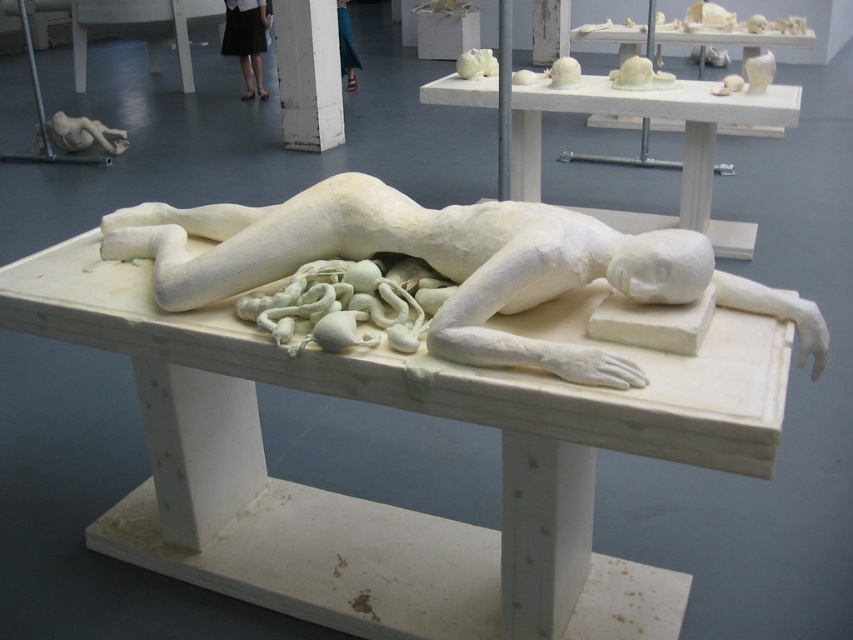
Question: Where is white marble table at center located in relation to matte white figure at upper left in the image?

Choices:
 (A) right
 (B) left

Answer: (A)

Question: In this image, where is white matte sculpture at center located relative to white matte table at upper center?

Choices:
 (A) left
 (B) right

Answer: (A)

Question: Is the position of white matte hand at center more distant than that of matte white figure at upper left?

Choices:
 (A) yes
 (B) no

Answer: (B)

Question: Considering the real-world distances, which object is closest to the white matte table at upper center?

Choices:
 (A) white matte sculpture at center
 (B) matte white figure at upper left
 (C) white matte hand at center
 (D) black skirt at upper center

Answer: (A)

Question: Which object is positioned closest to the white matte hand at center?

Choices:
 (A) white matte sculpture at center
 (B) white matte table at upper center

Answer: (A)

Question: Which point is farther to the camera?

Choices:
 (A) white matte table at upper center
 (B) white matte sculpture at center

Answer: (A)